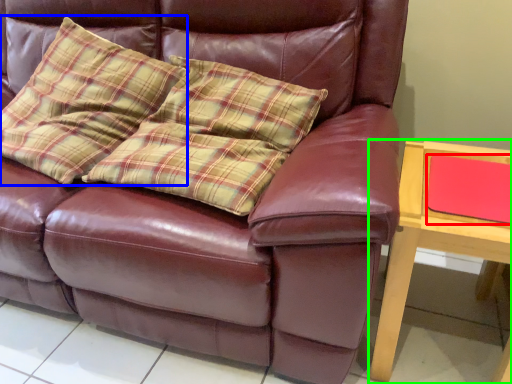
Question: Which object is positioned farthest from pad (highlighted by a red box)? Select from throw pillow (highlighted by a blue box) and table (highlighted by a green box).

Choices:
 (A) throw pillow
 (B) table

Answer: (A)